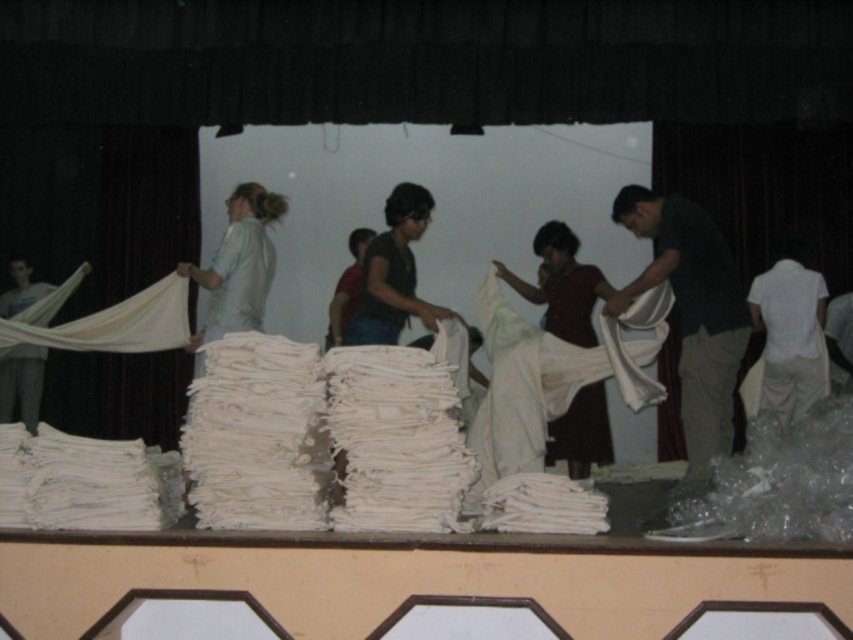
Question: Considering the relative positions of white fabric at right and matte gray pants at left in the image provided, where is white fabric at right located with respect to matte gray pants at left?

Choices:
 (A) above
 (B) below

Answer: (A)

Question: Does matte white fabric at center appear over matte gray pants at left?

Choices:
 (A) yes
 (B) no

Answer: (A)

Question: Which point appears closest to the camera in this image?

Choices:
 (A) (16, 406)
 (B) (746, 337)
 (C) (547, 241)
 (D) (799, 376)

Answer: (B)

Question: Estimate the real-world distances between objects in this image. Which object is farther from the matte gray pants at left?

Choices:
 (A) white cotton shirt at right
 (B) matte white fabric at center
 (C) white fabric at right

Answer: (A)

Question: Which of these objects is positioned farthest from the matte gray pants at left?

Choices:
 (A) white fabric at right
 (B) white cotton shirt at right

Answer: (B)

Question: Is white fabric at right to the left of matte gray pants at left from the viewer's perspective?

Choices:
 (A) no
 (B) yes

Answer: (A)